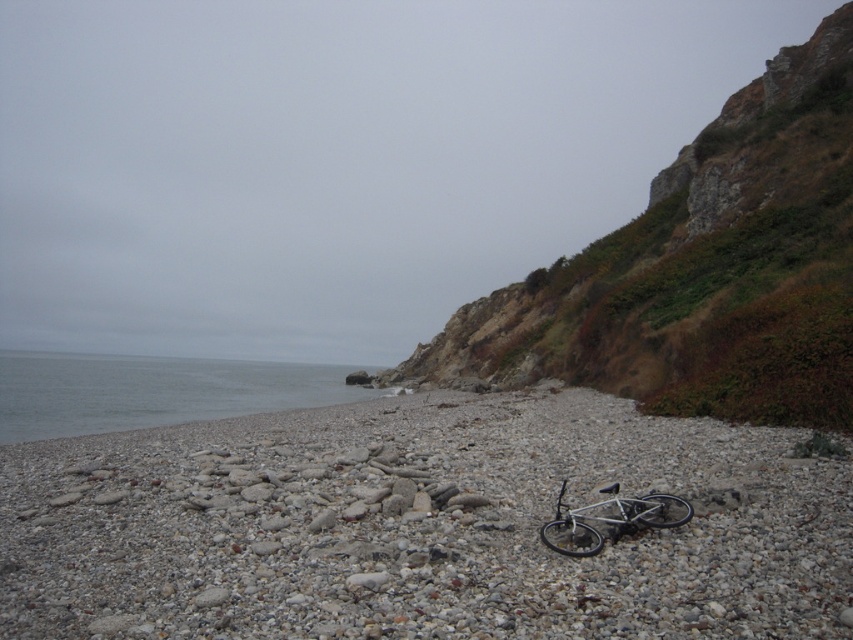
Can you confirm if smooth gravel beach at center is smaller than gray smooth water at lower left?

Indeed, smooth gravel beach at center has a smaller size compared to gray smooth water at lower left.

Between smooth gravel beach at center and gray smooth water at lower left, which one is positioned lower?

gray smooth water at lower left is lower down.

Locate an element on the screen. This screenshot has width=853, height=640. smooth gravel beach at center is located at coordinates (421, 525).

Can you confirm if smooth gravel beach at center is taller than rusty stone hillside at upper right?

In fact, smooth gravel beach at center may be shorter than rusty stone hillside at upper right.

What are the coordinates of `smooth gravel beach at center` in the screenshot? It's located at (421, 525).

At what (x,y) coordinates should I click in order to perform the action: click on smooth gravel beach at center. Please return your answer as a coordinate pair (x, y). The width and height of the screenshot is (853, 640). Looking at the image, I should click on (421, 525).

Can you confirm if smooth gravel beach at center is bigger than silver metallic bicycle at center?

Correct, smooth gravel beach at center is larger in size than silver metallic bicycle at center.

Which is in front, point (387, 580) or point (579, 518)?

Positioned in front is point (387, 580).

This screenshot has height=640, width=853. What are the coordinates of `smooth gravel beach at center` in the screenshot? It's located at (421, 525).